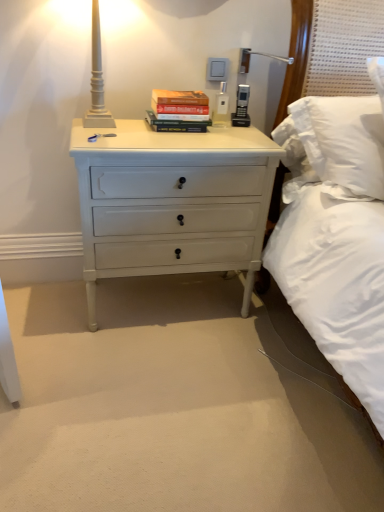
Question: Is white matte lamp at upper left inside white painted wood chest of drawers at center?

Choices:
 (A) no
 (B) yes

Answer: (A)

Question: Is white painted wood chest of drawers at center to the left of white matte lamp at upper left from the viewer's perspective?

Choices:
 (A) yes
 (B) no

Answer: (B)

Question: Considering the relative positions of white painted wood chest of drawers at center and white matte lamp at upper left in the image provided, is white painted wood chest of drawers at center to the right of white matte lamp at upper left from the viewer's perspective?

Choices:
 (A) no
 (B) yes

Answer: (B)

Question: From the image's perspective, would you say white painted wood chest of drawers at center is positioned over white matte lamp at upper left?

Choices:
 (A) no
 (B) yes

Answer: (A)

Question: Is white painted wood chest of drawers at center in contact with white matte lamp at upper left?

Choices:
 (A) yes
 (B) no

Answer: (B)

Question: Based on their sizes in the image, would you say white painted wood chest of drawers at center is bigger or smaller than white matte lamp at upper left?

Choices:
 (A) small
 (B) big

Answer: (B)

Question: Visually, is white painted wood chest of drawers at center positioned to the left or to the right of white matte lamp at upper left?

Choices:
 (A) right
 (B) left

Answer: (A)

Question: In terms of height, does white painted wood chest of drawers at center look taller or shorter compared to white matte lamp at upper left?

Choices:
 (A) tall
 (B) short

Answer: (A)

Question: From a real-world perspective, is white painted wood chest of drawers at center positioned above or below white matte lamp at upper left?

Choices:
 (A) above
 (B) below

Answer: (B)

Question: In terms of width, does hardcover book at center look wider or thinner when compared to white matte lamp at upper left?

Choices:
 (A) wide
 (B) thin

Answer: (B)

Question: Choose the correct answer: Is hardcover book at center inside white matte lamp at upper left or outside it?

Choices:
 (A) outside
 (B) inside

Answer: (A)

Question: From the image's perspective, relative to white matte lamp at upper left, is hardcover book at center above or below?

Choices:
 (A) below
 (B) above

Answer: (A)

Question: Relative to white matte lamp at upper left, is hardcover book at center in front or behind?

Choices:
 (A) behind
 (B) front

Answer: (A)

Question: Is white matte lamp at upper left spatially inside white painted wood chest of drawers at center, or outside of it?

Choices:
 (A) outside
 (B) inside

Answer: (A)

Question: In the image, is white matte lamp at upper left on the left side or the right side of white painted wood chest of drawers at center?

Choices:
 (A) left
 (B) right

Answer: (A)